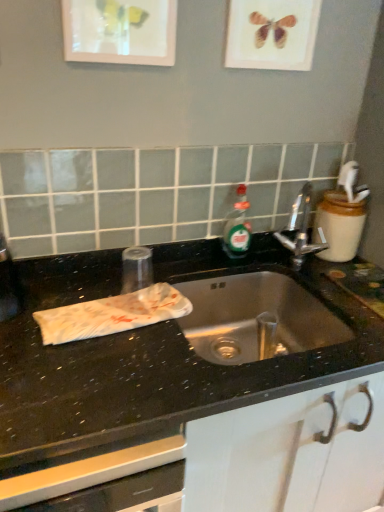
Question: Relative to black granite sink at center, is matte glass picture frame at upper center, the second picture frame when ordered from right to left, in front or behind?

Choices:
 (A) behind
 (B) front

Answer: (A)

Question: Looking at their shapes, would you say matte glass picture frame at upper center, the second picture frame when ordered from right to left, is wider or thinner than black granite sink at center?

Choices:
 (A) wide
 (B) thin

Answer: (B)

Question: Estimate the real-world distances between objects in this image. Which object is closer to the polished chrome faucet at center?

Choices:
 (A) black granite sink at center
 (B) white paper towel at left
 (C) matte glass picture frame at upper center, the second picture frame when ordered from right to left
 (D) matte wooden picture frame at upper center, the second picture frame from the left

Answer: (A)

Question: Estimate the real-world distances between objects in this image. Which object is farther from the black granite sink at center?

Choices:
 (A) polished chrome faucet at center
 (B) white paper towel at left
 (C) matte glass picture frame at upper center, the second picture frame when ordered from right to left
 (D) matte wooden picture frame at upper center, the first picture frame in the right-to-left sequence

Answer: (D)